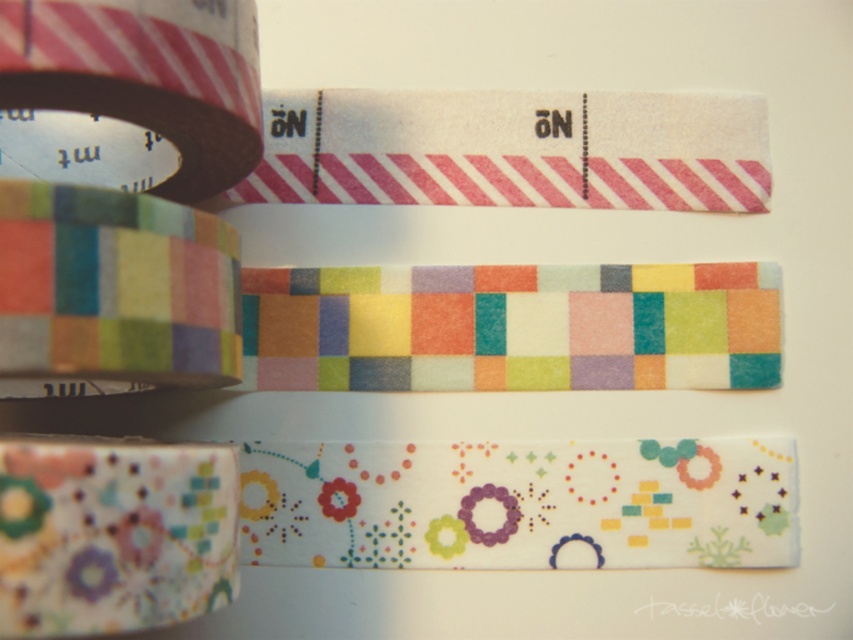
Does multicolored fabric measuring tape at upper left have a greater width compared to matte black tape at left?

In fact, multicolored fabric measuring tape at upper left might be narrower than matte black tape at left.

Does multicolored fabric measuring tape at upper left appear on the right side of matte black tape at left?

Yes, multicolored fabric measuring tape at upper left is to the right of matte black tape at left.

Which is behind, point (112, 280) or point (167, 36)?

The point (167, 36) is more distant.

At what (x,y) coordinates should I click in order to perform the action: click on multicolored fabric measuring tape at upper left. Please return your answer as a coordinate pair (x, y). The height and width of the screenshot is (640, 853). Looking at the image, I should click on pos(113,284).

Does floral-patterned paper tape at lower left have a greater height compared to multicolored fabric measuring tape at upper left?

Incorrect, floral-patterned paper tape at lower left's height is not larger of multicolored fabric measuring tape at upper left's.

Does floral-patterned paper tape at lower left lie in front of multicolored fabric measuring tape at upper left?

That is True.

Which is in front, point (113, 452) or point (113, 221)?

Positioned in front is point (113, 452).

Find the location of a particular element. floral-patterned paper tape at lower left is located at coordinates (113, 534).

Who is more forward, [187,552] or [67,42]?

Point [67,42] is in front.

Does point (91, 499) lie behind point (154, 122)?

That is False.

Does point (47, 518) come behind point (178, 138)?

No, it is in front of (178, 138).

I want to click on floral-patterned paper tape at lower left, so click(113, 534).